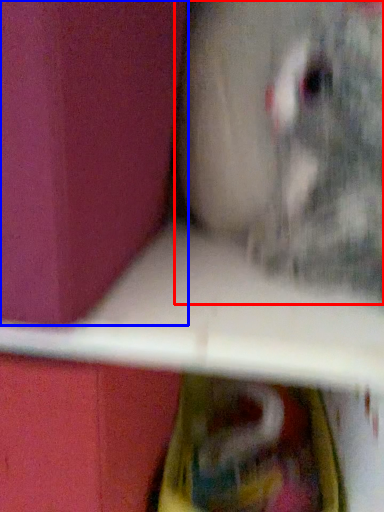
Question: Which object appears farthest to the camera in this image, animal (highlighted by a red box) or box (highlighted by a blue box)?

Choices:
 (A) animal
 (B) box

Answer: (A)